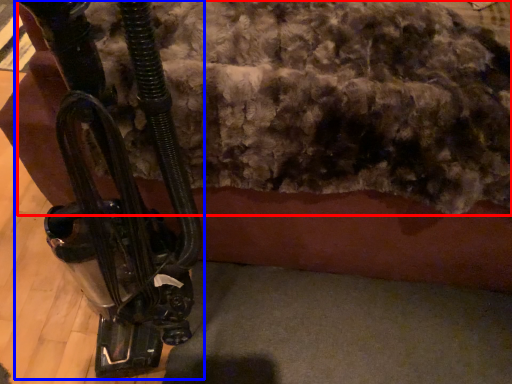
Question: Which object appears farthest to the camera in this image, wool (highlighted by a red box) or vehicle (highlighted by a blue box)?

Choices:
 (A) wool
 (B) vehicle

Answer: (A)